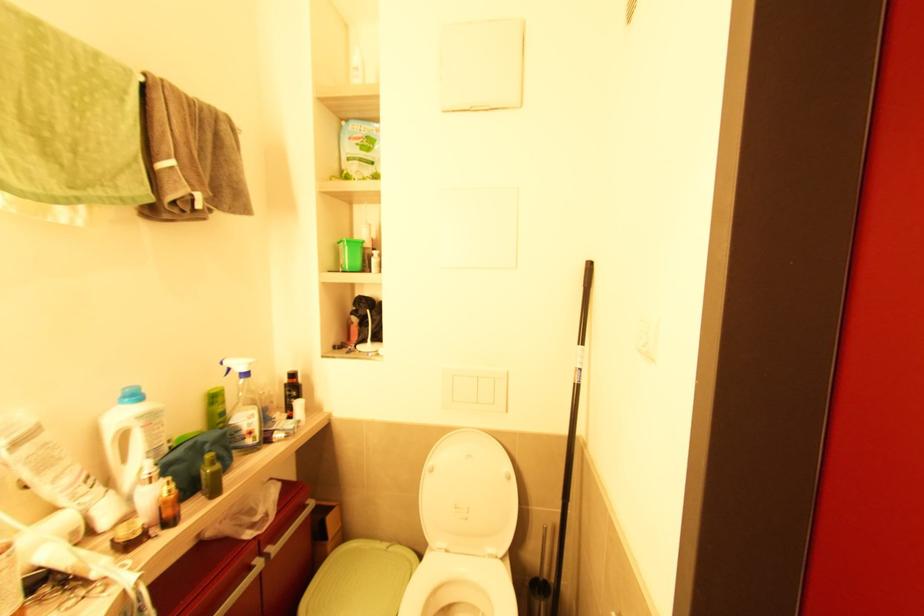
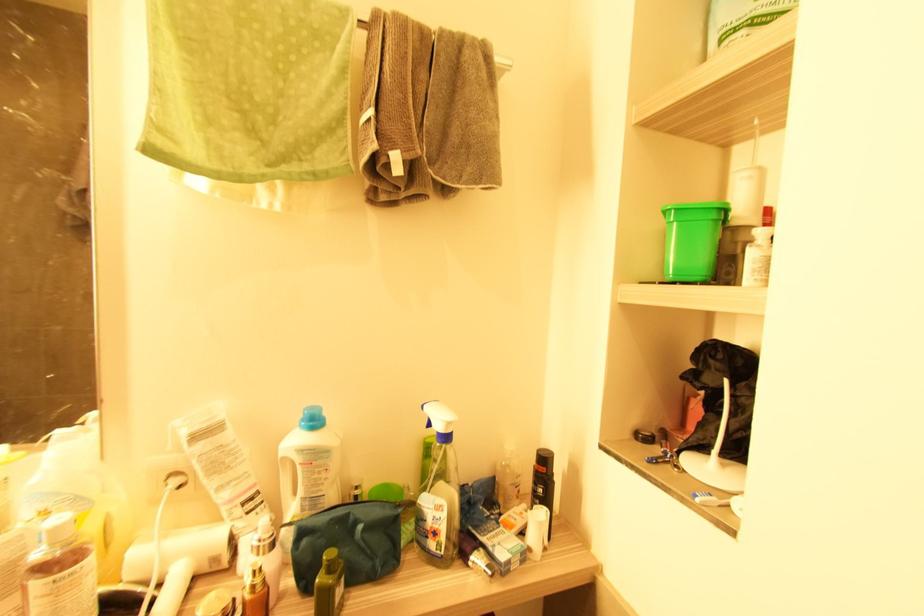
Find the pixel in the second image that matches (x=76, y=533) in the first image.

(216, 561)